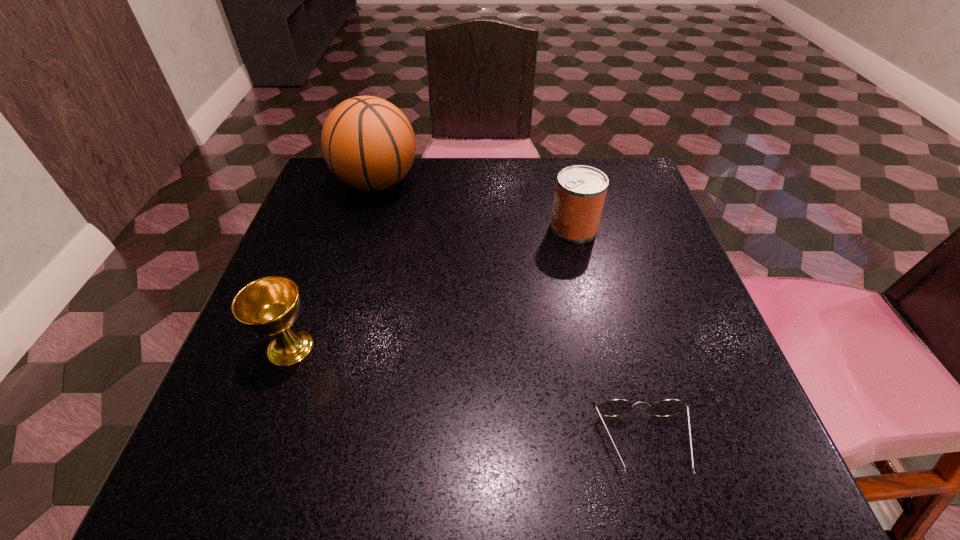
Find the location of a particular element. The image size is (960, 540). vacant area at the near edge is located at coordinates (614, 439).

Image resolution: width=960 pixels, height=540 pixels. I want to click on vacant space at the left edge of the desktop, so click(302, 424).

I want to click on vacant region at the right edge of the desktop, so click(x=682, y=348).

This screenshot has height=540, width=960. In order to click on vacant space at the far right corner of the desktop in this screenshot , I will do `click(622, 200)`.

This screenshot has width=960, height=540. I want to click on vacant point at the near right corner, so click(x=688, y=479).

This screenshot has width=960, height=540. In order to click on vacant area between the second nearest object and the third nearest object in this screenshot , I will do `click(432, 287)`.

Locate an element on the screen. Image resolution: width=960 pixels, height=540 pixels. vacant area that lies between the basketball and the second farthest object is located at coordinates (475, 205).

Where is `vacant region between the third farthest object and the third nearest object`? The width and height of the screenshot is (960, 540). vacant region between the third farthest object and the third nearest object is located at coordinates (432, 287).

Find the location of a particular element. The image size is (960, 540). vacant area between the can and the second nearest object is located at coordinates (432, 287).

Image resolution: width=960 pixels, height=540 pixels. In order to click on vacant region between the spectacles and the third farthest object in this screenshot , I will do `click(468, 396)`.